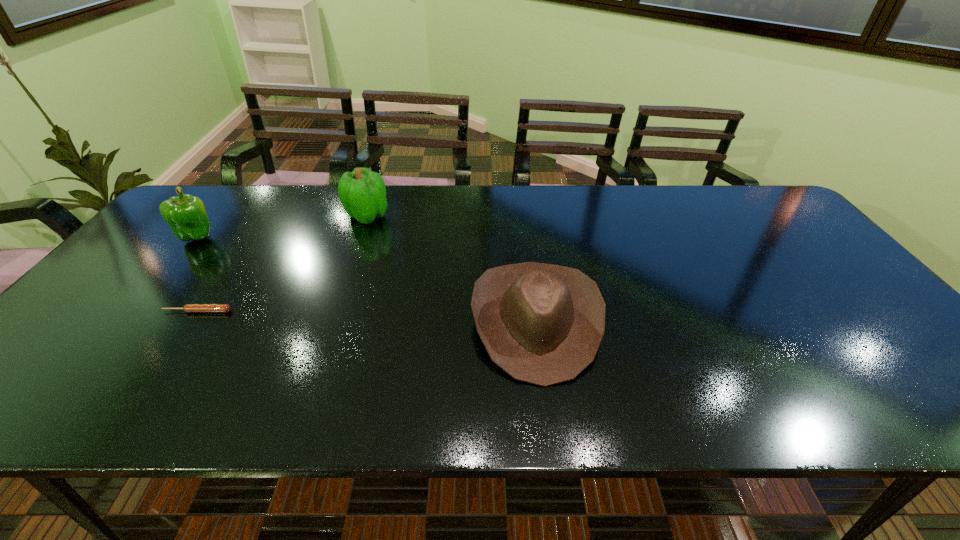
Locate an element on the screen. blank area in the image that satisfies the following two spatial constraints: 1. on the front side of the third object from left to right; 2. on the left side of the second shortest object is located at coordinates (330, 321).

The height and width of the screenshot is (540, 960). What are the coordinates of `vacant space that satisfies the following two spatial constraints: 1. on the back side of the right bell pepper; 2. on the left side of the shortest object` in the screenshot? It's located at (262, 215).

Locate an element on the screen. vacant region that satisfies the following two spatial constraints: 1. on the back side of the left bell pepper; 2. on the right side of the right bell pepper is located at coordinates (215, 215).

The width and height of the screenshot is (960, 540). Identify the location of free space in the image that satisfies the following two spatial constraints: 1. on the front side of the sausage; 2. on the right side of the rightmost object. (190, 321).

What are the coordinates of `vacant area that satisfies the following two spatial constraints: 1. on the front side of the second object from left to right; 2. on the left side of the leftmost object` in the screenshot? It's located at (136, 312).